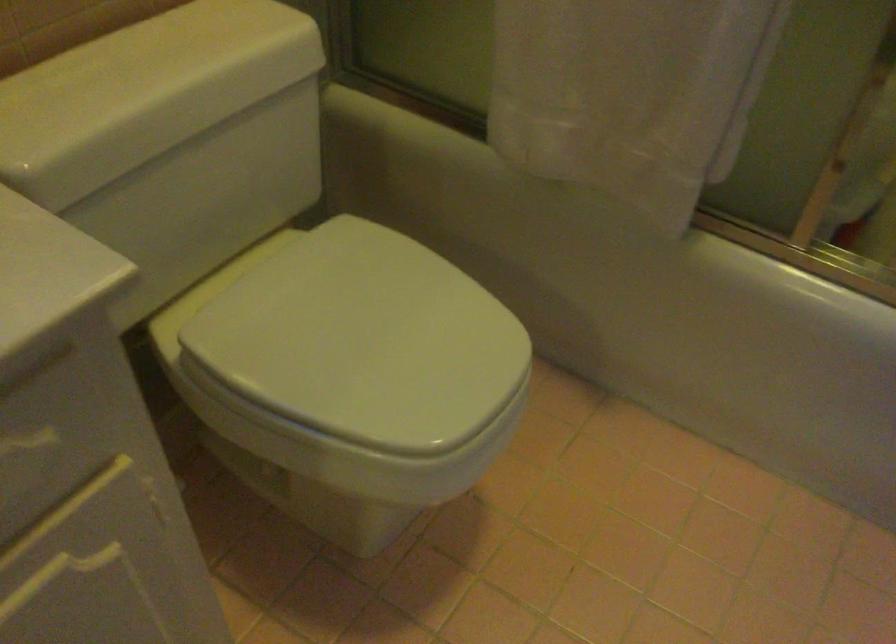
Where would you pull the cabinet drawer pull? Please return your answer as a coordinate pair (x, y).

(26, 442)